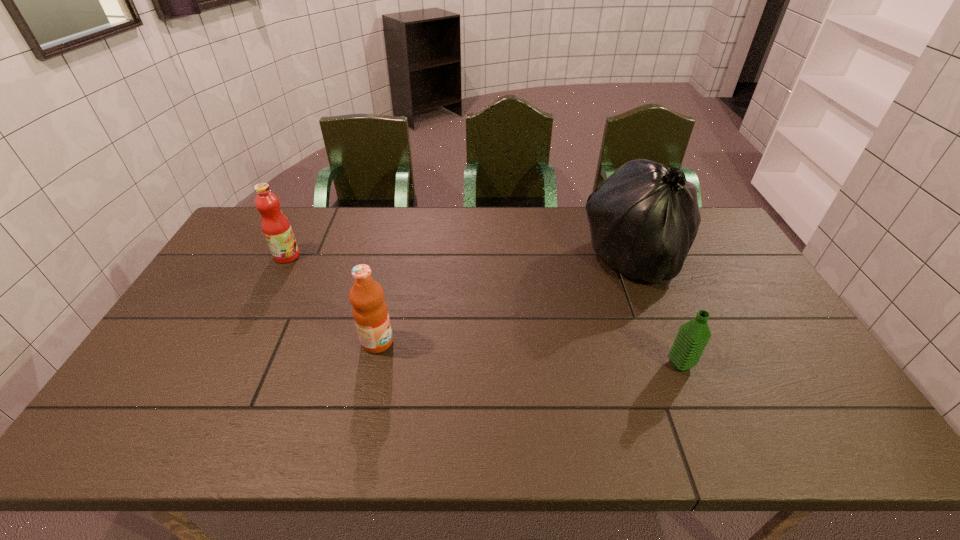
Locate an element on the screen. free space that satisfies the following two spatial constraints: 1. on the front label of the left fruit juice; 2. on the back side of the shortest object is located at coordinates (231, 364).

Find the location of `free location that satisfies the following two spatial constraints: 1. on the front label of the leftmost object; 2. on the left side of the plastic bag`. free location that satisfies the following two spatial constraints: 1. on the front label of the leftmost object; 2. on the left side of the plastic bag is located at coordinates (285, 259).

Identify the location of free spot that satisfies the following two spatial constraints: 1. on the front label of the shortest object; 2. on the left side of the leftmost object. (231, 364).

Where is `vacant region that satisfies the following two spatial constraints: 1. on the front label of the tallest object; 2. on the right side of the left fruit juice`? vacant region that satisfies the following two spatial constraints: 1. on the front label of the tallest object; 2. on the right side of the left fruit juice is located at coordinates (285, 259).